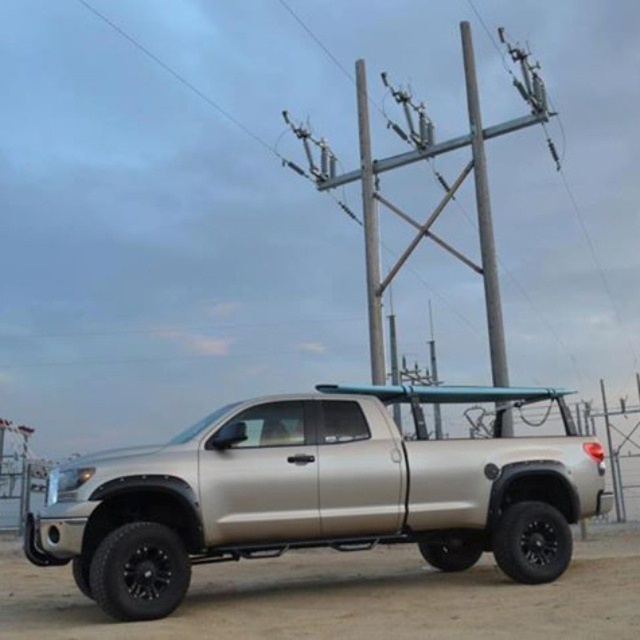
Question: In this image, where is satin silver truck at center located relative to gray metallic telegraph pole at upper center?

Choices:
 (A) below
 (B) above

Answer: (A)

Question: Is the position of satin silver truck at center more distant than that of gray metallic telegraph pole at upper center?

Choices:
 (A) yes
 (B) no

Answer: (B)

Question: Which object is positioned farthest from the satin silver truck at center?

Choices:
 (A) gray metallic telegraph pole at upper center
 (B) brown dirt at lower center

Answer: (A)

Question: Which of the following is the farthest from the observer?

Choices:
 (A) gray metallic telegraph pole at upper center
 (B) brown dirt at lower center

Answer: (A)

Question: Which of the following is the farthest from the observer?

Choices:
 (A) (486, 532)
 (B) (628, 541)

Answer: (B)

Question: Does satin silver truck at center appear under brown dirt at lower center?

Choices:
 (A) no
 (B) yes

Answer: (A)